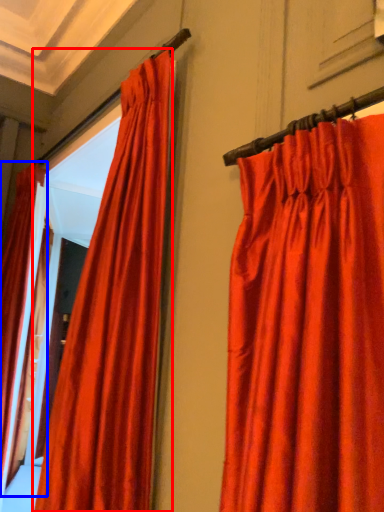
Question: Which object appears closest to the camera in this image, curtain (highlighted by a red box) or curtain (highlighted by a blue box)?

Choices:
 (A) curtain
 (B) curtain

Answer: (A)